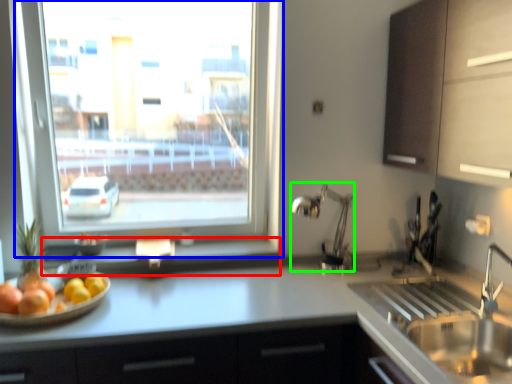
Question: Considering the real-world distances, which object is farthest from window sill (highlighted by a red box)? window (highlighted by a blue box) or faucet (highlighted by a green box)?

Choices:
 (A) window
 (B) faucet

Answer: (A)